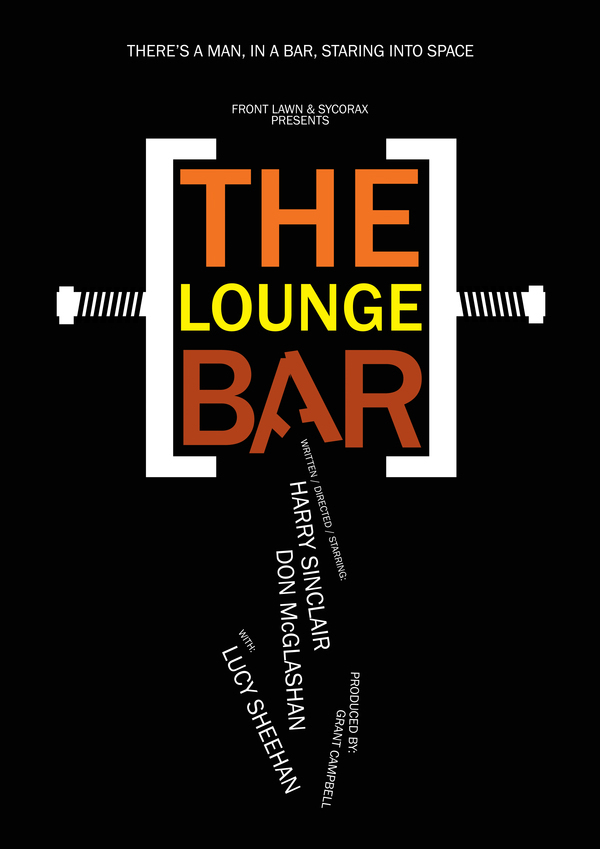
Where is `lounge`? The width and height of the screenshot is (600, 849). lounge is located at coordinates (248, 311).